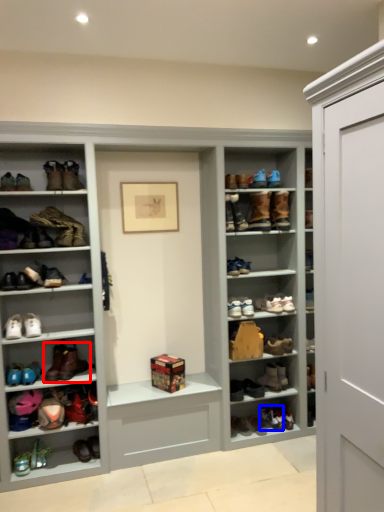
Question: Among these objects, which one is nearest to the camera, footwear (highlighted by a red box) or footwear (highlighted by a blue box)?

Choices:
 (A) footwear
 (B) footwear

Answer: (A)